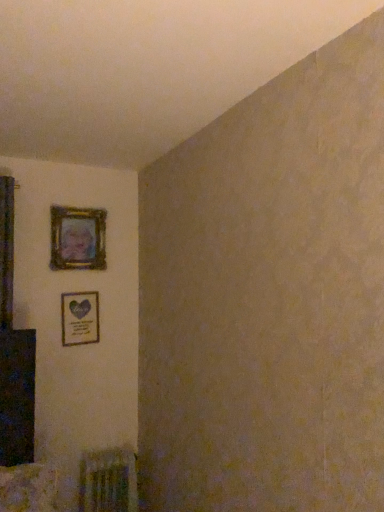
This screenshot has height=512, width=384. What do you see at coordinates (80, 318) in the screenshot?
I see `matte gold picture frame at upper left, arranged as the first picture frame when ordered from the bottom` at bounding box center [80, 318].

The image size is (384, 512). What do you see at coordinates (108, 481) in the screenshot? I see `metallic silver radiator at lower left` at bounding box center [108, 481].

In order to click on matte gold picture frame at upper left, placed as the 2th picture frame when sorted from top to bottom in this screenshot , I will do `click(80, 318)`.

Which object is wider, wooden frame at upper left, which ranks as the 1th picture frame in top-to-bottom order, or metallic silver radiator at lower left?

Wider between the two is metallic silver radiator at lower left.

Which is correct: wooden frame at upper left, which appears as the second picture frame when ordered from the bottom, is inside metallic silver radiator at lower left, or outside of it?

wooden frame at upper left, which appears as the second picture frame when ordered from the bottom, lies outside metallic silver radiator at lower left.

Is wooden frame at upper left, which ranks as the 1th picture frame in top-to-bottom order, to the left of metallic silver radiator at lower left from the viewer's perspective?

Correct, you'll find wooden frame at upper left, which ranks as the 1th picture frame in top-to-bottom order, to the left of metallic silver radiator at lower left.

Considering the sizes of objects wooden frame at upper left, which appears as the second picture frame when ordered from the bottom, and metallic silver radiator at lower left in the image provided, who is bigger, wooden frame at upper left, which appears as the second picture frame when ordered from the bottom, or metallic silver radiator at lower left?

metallic silver radiator at lower left is bigger.

Could you measure the distance between metallic silver radiator at lower left and matte gold picture frame at upper left, placed as the 2th picture frame when sorted from top to bottom?

31.48 inches.

Which is in front, point (82, 508) or point (68, 300)?

The point (82, 508) is closer to the camera.

Between metallic silver radiator at lower left and matte gold picture frame at upper left, placed as the 2th picture frame when sorted from top to bottom, which one is positioned in front?

metallic silver radiator at lower left is in front.

Considering the positions of points (128, 502) and (97, 248), is point (128, 502) farther from camera compared to point (97, 248)?

No, it is not.

Does metallic silver radiator at lower left have a larger size compared to wooden frame at upper left, which appears as the second picture frame when ordered from the bottom?

Yes, metallic silver radiator at lower left is bigger than wooden frame at upper left, which appears as the second picture frame when ordered from the bottom.

Where is `the 1st picture frame behind the metallic silver radiator at lower left, starting your count from the anchor`? The height and width of the screenshot is (512, 384). the 1st picture frame behind the metallic silver radiator at lower left, starting your count from the anchor is located at coordinates (78, 238).

Find the location of `picture frame below the wooden frame at upper left, which ranks as the 1th picture frame in top-to-bottom order (from a real-world perspective)`. picture frame below the wooden frame at upper left, which ranks as the 1th picture frame in top-to-bottom order (from a real-world perspective) is located at coordinates (80, 318).

Which point is more distant from viewer, (51, 234) or (80, 332)?

The point (80, 332) is more distant.

Could you tell me if wooden frame at upper left, which appears as the second picture frame when ordered from the bottom, is turned towards matte gold picture frame at upper left, placed as the 2th picture frame when sorted from top to bottom?

No.

From a real-world perspective, between wooden frame at upper left, which appears as the second picture frame when ordered from the bottom, and matte gold picture frame at upper left, placed as the 2th picture frame when sorted from top to bottom, who is vertically lower?

matte gold picture frame at upper left, placed as the 2th picture frame when sorted from top to bottom, from a real-world perspective.

Which object is closer to the camera taking this photo, matte gold picture frame at upper left, arranged as the first picture frame when ordered from the bottom, or wooden frame at upper left, which ranks as the 1th picture frame in top-to-bottom order?

wooden frame at upper left, which ranks as the 1th picture frame in top-to-bottom order.

Is matte gold picture frame at upper left, arranged as the first picture frame when ordered from the bottom, bigger than wooden frame at upper left, which ranks as the 1th picture frame in top-to-bottom order?

No.

Based on the photo, can you tell me how much matte gold picture frame at upper left, placed as the 2th picture frame when sorted from top to bottom, and wooden frame at upper left, which ranks as the 1th picture frame in top-to-bottom order, differ in facing direction?

The angle between the facing direction of matte gold picture frame at upper left, placed as the 2th picture frame when sorted from top to bottom, and the facing direction of wooden frame at upper left, which ranks as the 1th picture frame in top-to-bottom order, is 0.443 degrees.

Considering the points (66, 340) and (90, 486), which point is behind, point (66, 340) or point (90, 486)?

The point (66, 340) is farther from the camera.

Would you say matte gold picture frame at upper left, placed as the 2th picture frame when sorted from top to bottom, is inside or outside metallic silver radiator at lower left?

matte gold picture frame at upper left, placed as the 2th picture frame when sorted from top to bottom, cannot be found inside metallic silver radiator at lower left.

Can you confirm if matte gold picture frame at upper left, placed as the 2th picture frame when sorted from top to bottom, is smaller than metallic silver radiator at lower left?

Yes, matte gold picture frame at upper left, placed as the 2th picture frame when sorted from top to bottom, is smaller than metallic silver radiator at lower left.

The height and width of the screenshot is (512, 384). In order to click on radiator in front of the matte gold picture frame at upper left, arranged as the first picture frame when ordered from the bottom in this screenshot , I will do `click(108, 481)`.

You are a GUI agent. You are given a task and a screenshot of the screen. Output one action in this format:
    pyautogui.click(x=<x>, y=<y>)
    Task: Click on the 2nd picture frame above the metallic silver radiator at lower left (from the image's perspective)
    
    Given the screenshot: What is the action you would take?
    click(x=78, y=238)

From a real-world perspective, count 1st picture frames upward from the metallic silver radiator at lower left and point to it. Please provide its 2D coordinates.

[(80, 318)]

From the image, which object appears to be nearer to metallic silver radiator at lower left, matte gold picture frame at upper left, arranged as the first picture frame when ordered from the bottom, or wooden frame at upper left, which ranks as the 1th picture frame in top-to-bottom order?

matte gold picture frame at upper left, arranged as the first picture frame when ordered from the bottom, is closer to metallic silver radiator at lower left.

From the image, which object appears to be farther from matte gold picture frame at upper left, placed as the 2th picture frame when sorted from top to bottom, wooden frame at upper left, which appears as the second picture frame when ordered from the bottom, or metallic silver radiator at lower left?

metallic silver radiator at lower left lies further to matte gold picture frame at upper left, placed as the 2th picture frame when sorted from top to bottom, than the other object.

From the image, which object appears to be farther from metallic silver radiator at lower left, wooden frame at upper left, which ranks as the 1th picture frame in top-to-bottom order, or matte gold picture frame at upper left, placed as the 2th picture frame when sorted from top to bottom?

The object further to metallic silver radiator at lower left is wooden frame at upper left, which ranks as the 1th picture frame in top-to-bottom order.

Based on their spatial positions, is matte gold picture frame at upper left, arranged as the first picture frame when ordered from the bottom, or metallic silver radiator at lower left further from wooden frame at upper left, which ranks as the 1th picture frame in top-to-bottom order?

Answer: metallic silver radiator at lower left is further to wooden frame at upper left, which ranks as the 1th picture frame in top-to-bottom order.

Which object lies further to the anchor point wooden frame at upper left, which appears as the second picture frame when ordered from the bottom, metallic silver radiator at lower left or matte gold picture frame at upper left, placed as the 2th picture frame when sorted from top to bottom?

metallic silver radiator at lower left is positioned further to the anchor wooden frame at upper left, which appears as the second picture frame when ordered from the bottom.

Estimate the real-world distances between objects in this image. Which object is further from matte gold picture frame at upper left, placed as the 2th picture frame when sorted from top to bottom, metallic silver radiator at lower left or wooden frame at upper left, which appears as the second picture frame when ordered from the bottom?

metallic silver radiator at lower left is positioned further to the anchor matte gold picture frame at upper left, placed as the 2th picture frame when sorted from top to bottom.

This screenshot has height=512, width=384. Find the location of `picture frame between wooden frame at upper left, which appears as the second picture frame when ordered from the bottom, and metallic silver radiator at lower left, in the vertical direction`. picture frame between wooden frame at upper left, which appears as the second picture frame when ordered from the bottom, and metallic silver radiator at lower left, in the vertical direction is located at coordinates [x=80, y=318].